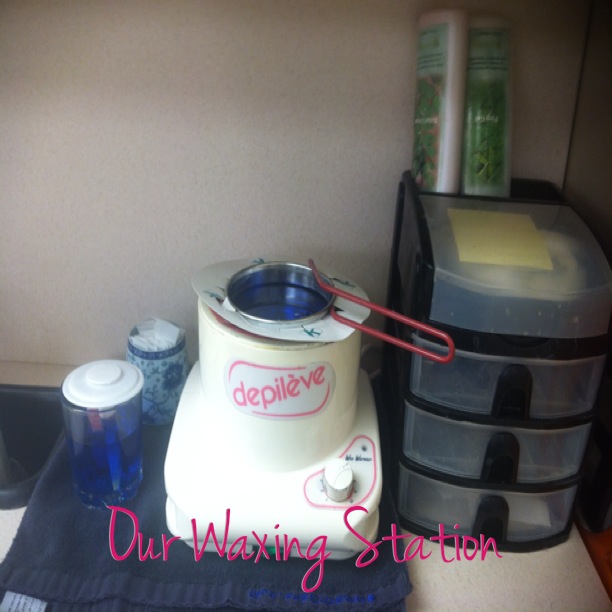
This screenshot has width=612, height=612. I want to click on counter top, so click(540, 595).